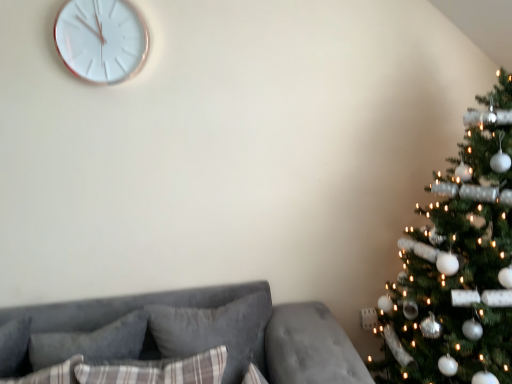
Question: Based on their positions, is plush gray pillow at lower left, acting as the second pillow starting from the front, located to the left or right of white glossy clock at upper left?

Choices:
 (A) left
 (B) right

Answer: (A)

Question: Is point 70,334 positioned closer to the camera than point 105,77?

Choices:
 (A) farther
 (B) closer

Answer: (B)

Question: Which of these objects is positioned closest to the plaid fabric pillow at center, which ranks as the 3th pillow in back-to-front order?

Choices:
 (A) green textured christmas tree at right
 (B) plush gray pillow at lower left, acting as the second pillow starting from the front
 (C) white glossy clock at upper left
 (D) velvet gray couch at lower left
 (E) plush gray pillow at center, placed as the third pillow when sorted from front to back

Answer: (E)

Question: Which object is positioned closest to the plush gray pillow at center, placed as the third pillow when sorted from front to back?

Choices:
 (A) green textured christmas tree at right
 (B) velvet gray couch at lower left
 (C) plush gray pillow at lower left, which appears as the second pillow when viewed from the back
 (D) white glossy clock at upper left
 (E) plaid fabric pillow at center, which ranks as the 3th pillow in back-to-front order

Answer: (B)